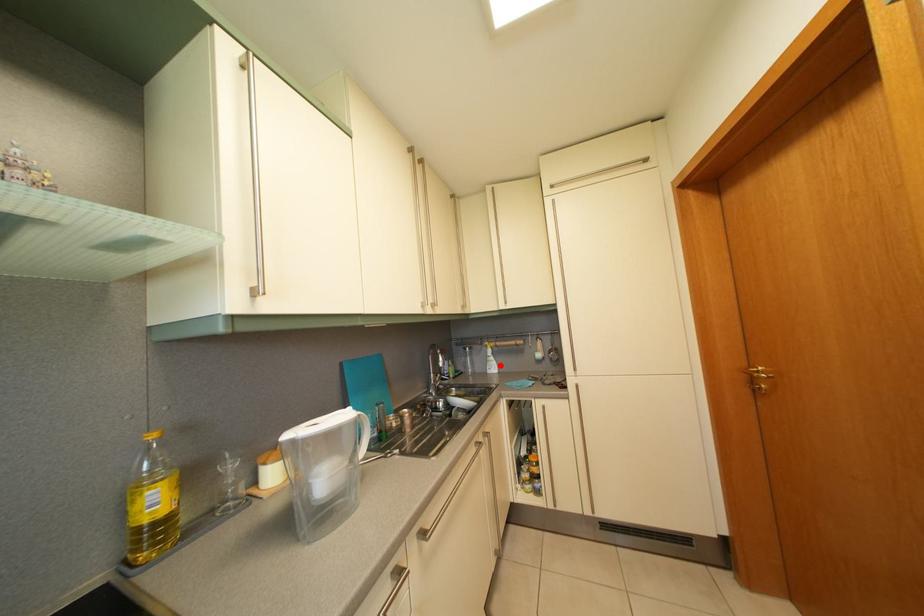
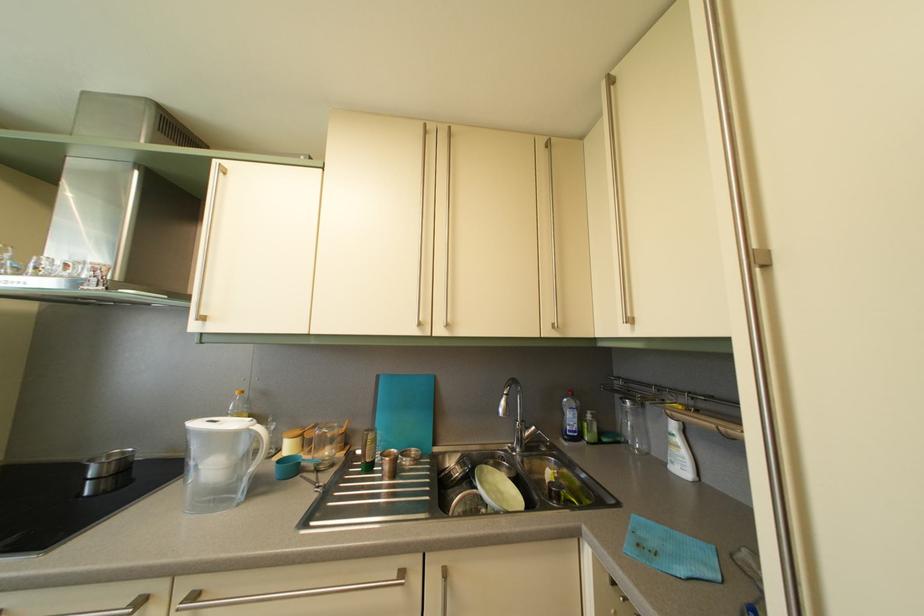
Where in the second image is the point corresponding to the highlighted location from the first image?

(687, 448)